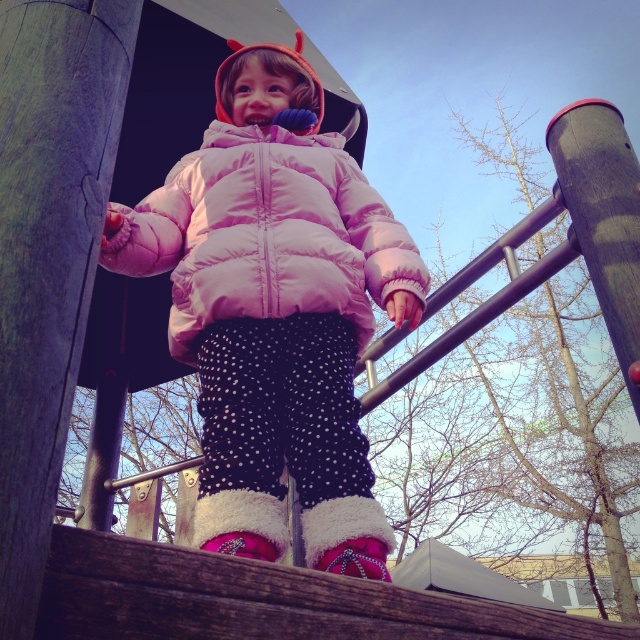
Question: Which point is farther to the camera?

Choices:
 (A) smooth gray pole at upper right
 (B) pink puffy jacket at center
 (C) pink quilted jacket at center

Answer: (C)

Question: Which object is closer to the camera taking this photo?

Choices:
 (A) pink quilted jacket at center
 (B) smooth gray pole at upper right
 (C) pink puffy jacket at center

Answer: (C)

Question: Does pink puffy jacket at center have a lesser width compared to pink quilted jacket at center?

Choices:
 (A) no
 (B) yes

Answer: (A)

Question: Which of the following is the farthest from the observer?

Choices:
 (A) pink puffy jacket at center
 (B) pink quilted jacket at center

Answer: (B)

Question: From the image, what is the correct spatial relationship of pink quilted jacket at center in relation to smooth gray pole at upper right?

Choices:
 (A) below
 (B) above

Answer: (B)

Question: Is pink puffy jacket at center to the right of pink quilted jacket at center from the viewer's perspective?

Choices:
 (A) no
 (B) yes

Answer: (B)